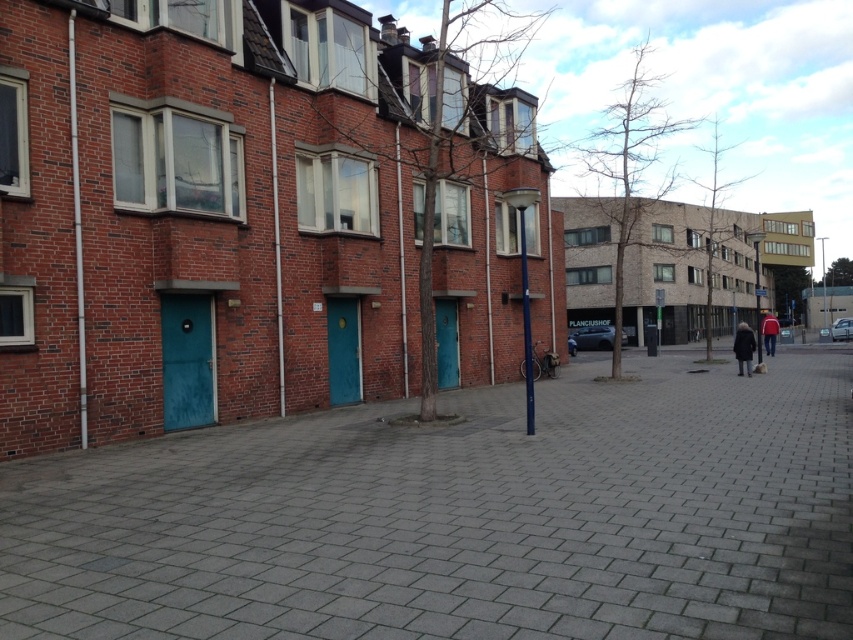
Which is behind, point (347, 435) or point (775, 346)?

Positioned behind is point (775, 346).

Between point (283, 598) and point (764, 326), which one is positioned behind?

The point (764, 326) is more distant.

The width and height of the screenshot is (853, 640). In order to click on gray concrete pavement at center in this screenshot , I will do `click(459, 518)`.

Which is below, gray concrete pavement at center or dark gray coat at lower right?

gray concrete pavement at center is lower down.

From the picture: Between gray concrete pavement at center and dark gray coat at lower right, which one appears on the left side from the viewer's perspective?

From the viewer's perspective, gray concrete pavement at center appears more on the left side.

Identify the location of gray concrete pavement at center. (459, 518).

Where is `gray concrete pavement at center`? gray concrete pavement at center is located at coordinates (459, 518).

Is dark gray coat at lower right behind red fabric jacket at right?

No.

Is point (737, 371) positioned before point (775, 353)?

Yes, point (737, 371) is in front of point (775, 353).

Image resolution: width=853 pixels, height=640 pixels. Identify the location of dark gray coat at lower right. (743, 348).